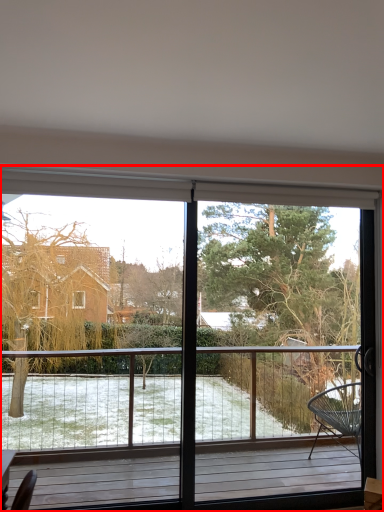
Question: Observing the image, what is the correct spatial positioning of window (annotated by the red box) in reference to tree?

Choices:
 (A) left
 (B) right

Answer: (A)